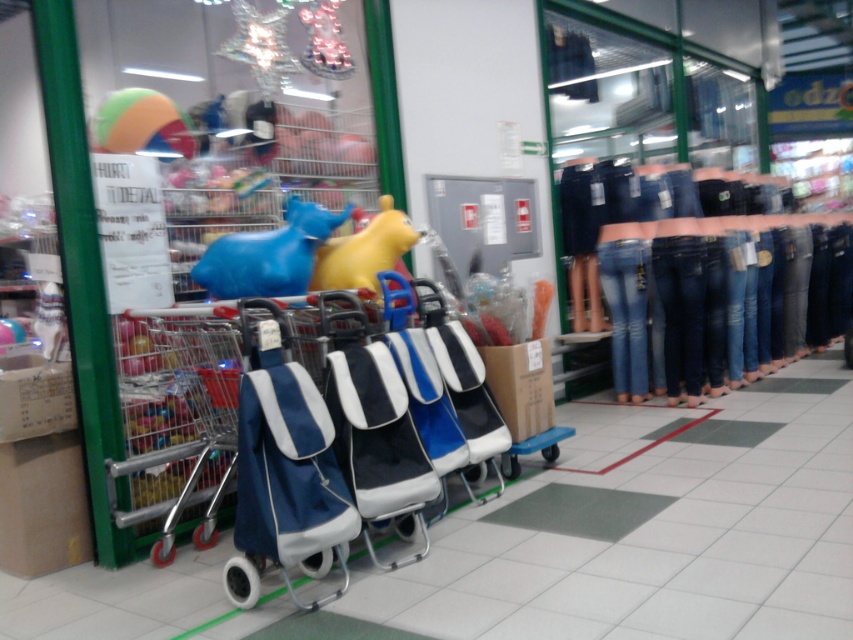
Between point (300, 284) and point (360, 232), which one is positioned behind?

Positioned behind is point (360, 232).

Between point (258, 244) and point (393, 253), which one is positioned behind?

The point (393, 253) is behind.

This screenshot has width=853, height=640. Find the location of `blue rubber horse at center`. blue rubber horse at center is located at coordinates (268, 253).

Which is below, denim jeans at right or denim at center?

denim at center

Which is in front, point (640, 348) or point (735, 234)?

Point (640, 348) is more forward.

Describe the element at coordinates (677, 236) in the screenshot. I see `denim jeans at right` at that location.

In order to click on denim jeans at right in this screenshot , I will do `click(677, 236)`.

Does denim jeans at right have a greater height compared to blue rubber horse at center?

Correct, denim jeans at right is much taller as blue rubber horse at center.

The image size is (853, 640). I want to click on denim jeans at right, so click(677, 236).

Identify the location of denim jeans at right. (677, 236).